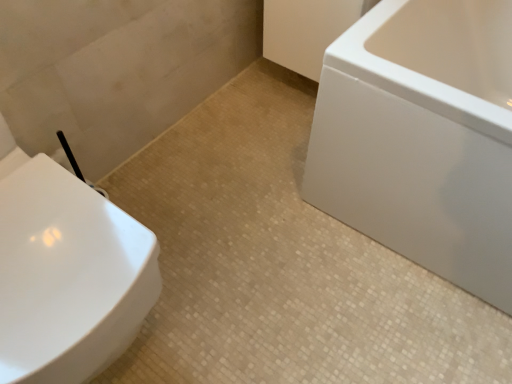
Question: From the image's perspective, is white glossy toilet at left above white glossy bathtub at right?

Choices:
 (A) no
 (B) yes

Answer: (A)

Question: Is white glossy toilet at left aimed at white glossy bathtub at right?

Choices:
 (A) no
 (B) yes

Answer: (A)

Question: Is white glossy toilet at left to the left of white glossy bathtub at right from the viewer's perspective?

Choices:
 (A) yes
 (B) no

Answer: (A)

Question: Considering the relative sizes of white glossy toilet at left and white glossy bathtub at right in the image provided, is white glossy toilet at left shorter than white glossy bathtub at right?

Choices:
 (A) yes
 (B) no

Answer: (B)

Question: Is white glossy toilet at left at the right side of white glossy bathtub at right?

Choices:
 (A) no
 (B) yes

Answer: (A)

Question: Looking at their shapes, would you say white glossy toilet at left is wider or thinner than white glossy bathtub at right?

Choices:
 (A) thin
 (B) wide

Answer: (A)

Question: Is point (50, 205) closer or farther from the camera than point (433, 241)?

Choices:
 (A) closer
 (B) farther

Answer: (A)

Question: In terms of size, does white glossy toilet at left appear bigger or smaller than white glossy bathtub at right?

Choices:
 (A) big
 (B) small

Answer: (B)

Question: Considering the positions of white glossy toilet at left and white glossy bathtub at right in the image, is white glossy toilet at left taller or shorter than white glossy bathtub at right?

Choices:
 (A) tall
 (B) short

Answer: (A)

Question: Considering the positions of white glossy bathtub at right and white glossy toilet at left in the image, is white glossy bathtub at right taller or shorter than white glossy toilet at left?

Choices:
 (A) tall
 (B) short

Answer: (B)

Question: Based on their sizes in the image, would you say white glossy bathtub at right is bigger or smaller than white glossy toilet at left?

Choices:
 (A) small
 (B) big

Answer: (B)

Question: From a real-world perspective, is white glossy bathtub at right above or below white glossy toilet at left?

Choices:
 (A) below
 (B) above

Answer: (A)

Question: In terms of width, does white glossy bathtub at right look wider or thinner when compared to white glossy toilet at left?

Choices:
 (A) wide
 (B) thin

Answer: (A)

Question: Considering the positions of white glossy toilet at left and beige mosaic tile at center in the image, is white glossy toilet at left bigger or smaller than beige mosaic tile at center?

Choices:
 (A) big
 (B) small

Answer: (A)

Question: Is point (99, 216) closer or farther from the camera than point (284, 254)?

Choices:
 (A) farther
 (B) closer

Answer: (B)